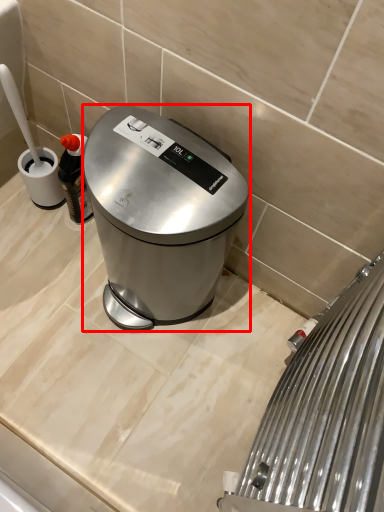
Question: Where is kitchen appliance (annotated by the red box) located in relation to home appliance in the image?

Choices:
 (A) right
 (B) left

Answer: (B)